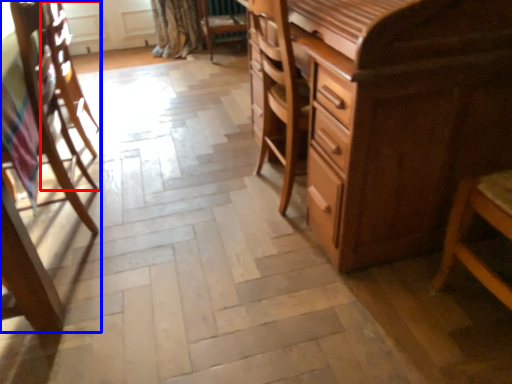
Question: Which point is closer to the camera, armchair (highlighted by a red box) or chair (highlighted by a blue box)?

Choices:
 (A) armchair
 (B) chair

Answer: (B)